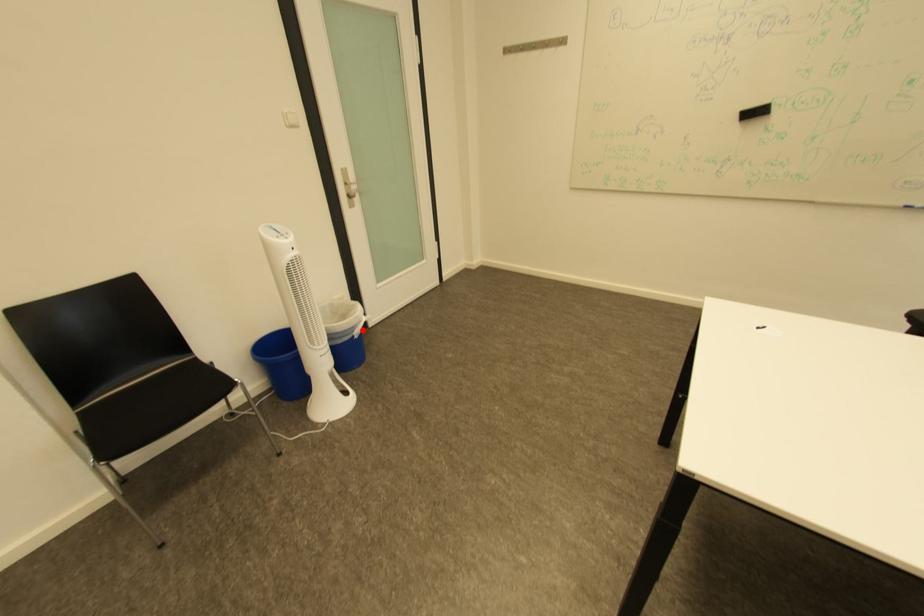
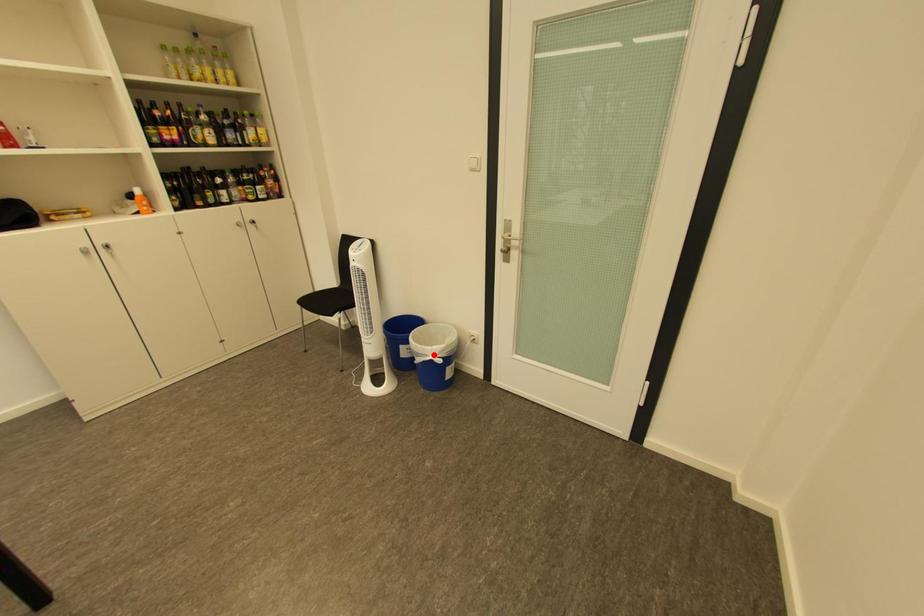
I am providing you with two images of the same scene from different viewpoints. A red point is marked on the first image and another point is marked on the second image. Does the point marked in image1 correspond to the same location as the one in image2?

No